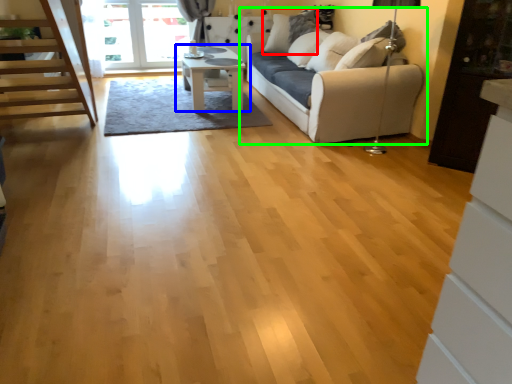
Question: Estimate the real-world distances between objects in this image. Which object is closer to pillow (highlighted by a red box), table (highlighted by a blue box) or studio couch (highlighted by a green box)?

Choices:
 (A) table
 (B) studio couch

Answer: (B)